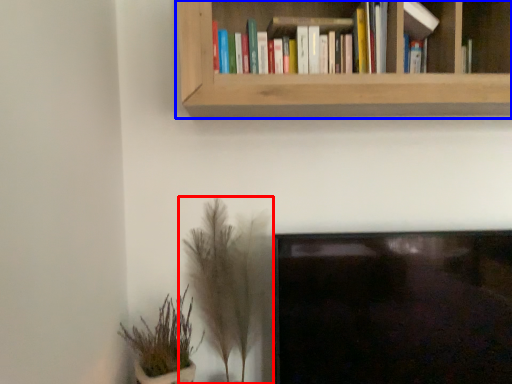
Question: Which point is further to the camera, houseplant (highlighted by a red box) or bookcase (highlighted by a blue box)?

Choices:
 (A) houseplant
 (B) bookcase

Answer: (A)